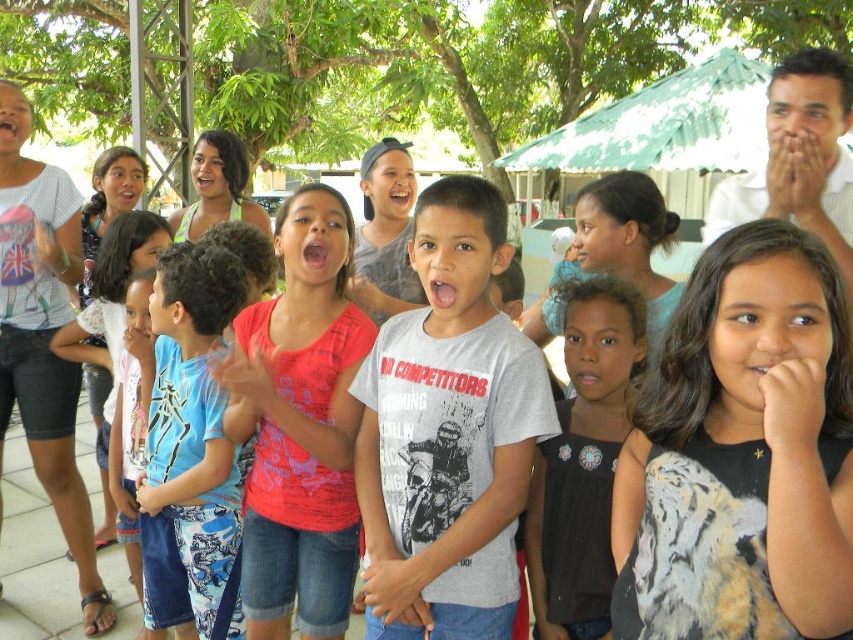
You are a photographer trying to capture a group photo of the children. You notice two shirts at the center of the group, a gray matte shirt at center and a black satin blouse at center. Which shirt should you focus on to ensure it appears more prominent in the photo?

The gray matte shirt at center has a larger size compared to the black satin blouse at center, so focusing on the gray matte shirt at center would make it appear more prominent in the photo.

You are a photographer trying to capture a group shot of the children. You notice the matte pink shirt at center and the blue printed shorts at center. Which clothing item occupies more horizontal space in the photo?

→ The matte pink shirt at center has a greater width than the blue printed shorts at center, so it occupies more horizontal space in the photo.

You are standing at the point marked as point (x=395, y=472) in the image. If you want to walk towards the nearest tree in the background, which direction should you move relative to your current position?

The point (x=395, y=472) is 2.54 meters away from the viewer. To walk towards the nearest tree in the background, you should move forward since the trees are in the background area of the image.